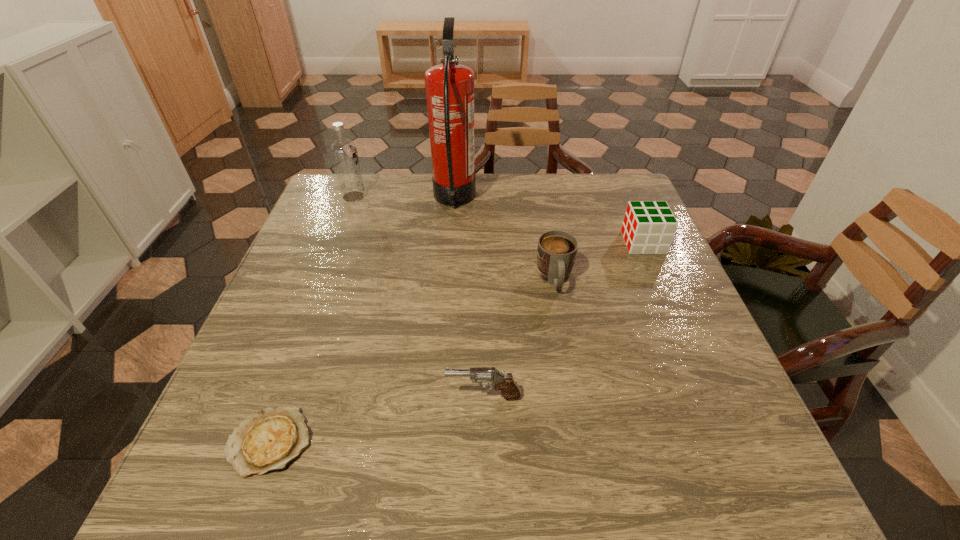
The height and width of the screenshot is (540, 960). What are the coordinates of `free region located on the front label of the second tallest object` in the screenshot? It's located at (399, 197).

At what (x,y) coordinates should I click in order to perform the action: click on free space located 0.070m on the side of the second object from right to left with the handle. Please return your answer as a coordinate pair (x, y). This screenshot has height=540, width=960. Looking at the image, I should click on (563, 323).

This screenshot has width=960, height=540. Identify the location of free space located on the red face of the rightmost object. (525, 242).

This screenshot has width=960, height=540. In order to click on vacant space located 0.320m on the red face of the rightmost object in this screenshot , I will do `click(502, 242)`.

The image size is (960, 540). What are the coordinates of `free space located on the red face of the rightmost object` in the screenshot? It's located at (567, 242).

Locate an element on the screen. This screenshot has height=540, width=960. vacant space located at the barrel of the fifth farthest object is located at coordinates (263, 396).

Locate an element on the screen. This screenshot has height=540, width=960. free region located 0.270m at the barrel of the fifth farthest object is located at coordinates (300, 396).

Where is `free region located 0.330m at the barrel of the fifth farthest object`? free region located 0.330m at the barrel of the fifth farthest object is located at coordinates (269, 396).

Locate an element on the screen. This screenshot has height=540, width=960. vacant space located on the back of the shortest object is located at coordinates (315, 318).

This screenshot has width=960, height=540. What are the coordinates of `fire extinguisher that is at the far edge` in the screenshot? It's located at 449,87.